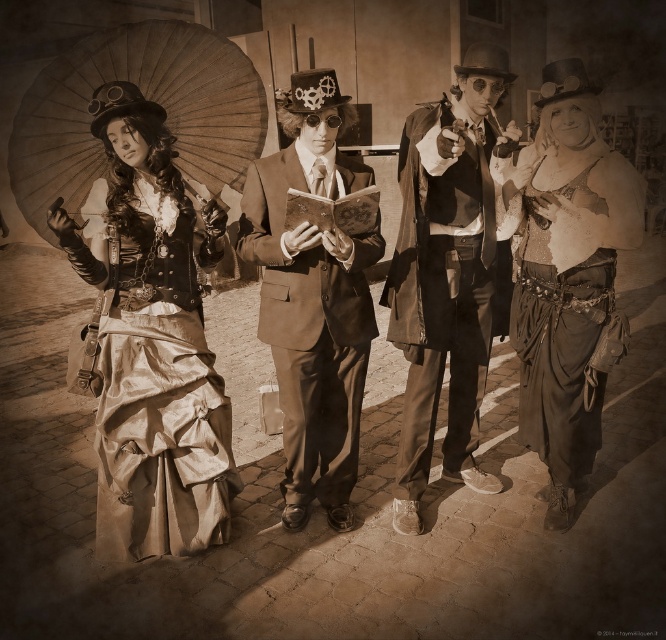
Question: Is shiny silver corset at center bigger than matte brown suit at center?

Choices:
 (A) no
 (B) yes

Answer: (A)

Question: Which object is positioned closest to the shiny gold skirt at left?

Choices:
 (A) matte brown coat at center
 (B) matte paper umbrella at left
 (C) matte brown suit at center
 (D) shiny silver corset at center

Answer: (B)

Question: Which object is closer to the camera taking this photo?

Choices:
 (A) shiny gold skirt at left
 (B) matte paper umbrella at left
 (C) matte brown coat at center
 (D) matte brown suit at center

Answer: (A)

Question: Is shiny silver corset at center thinner than matte brown coat at center?

Choices:
 (A) no
 (B) yes

Answer: (B)

Question: Which point is farther to the camera?

Choices:
 (A) (324, 97)
 (B) (73, 52)
 (C) (123, 241)
 (D) (595, 145)

Answer: (D)

Question: Is shiny gold skirt at left positioned before matte paper umbrella at left?

Choices:
 (A) yes
 (B) no

Answer: (A)